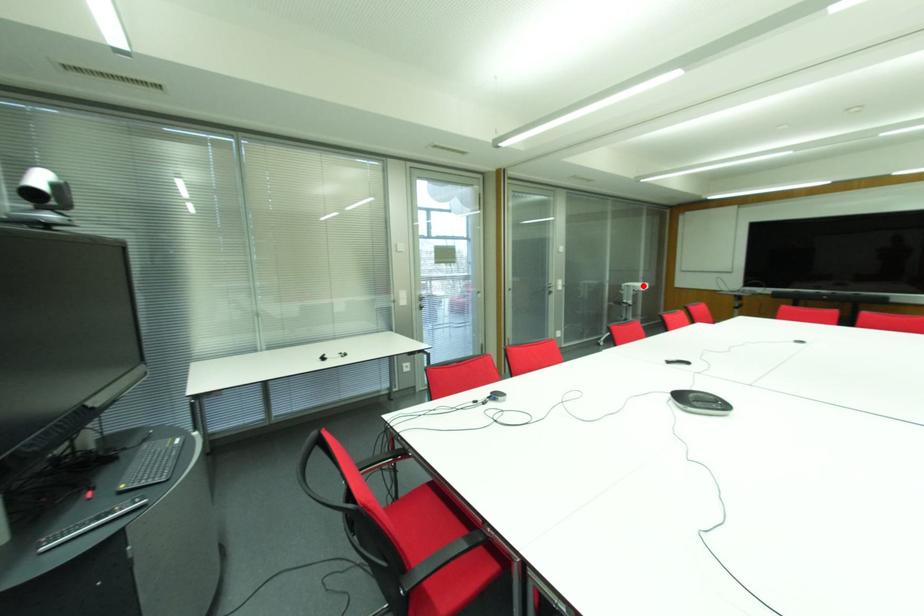
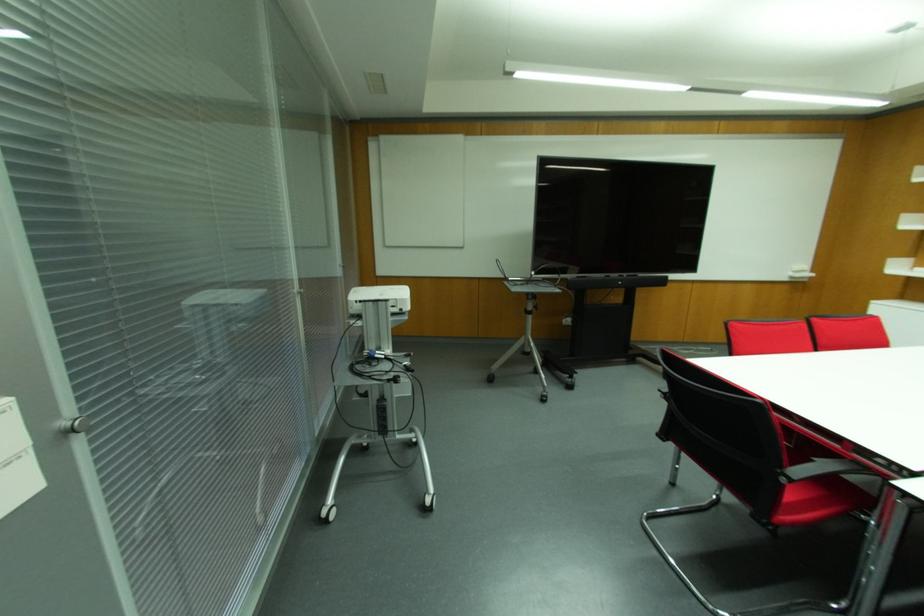
Where in the second image is the point corresponding to the highlighted location from the first image?

(399, 294)